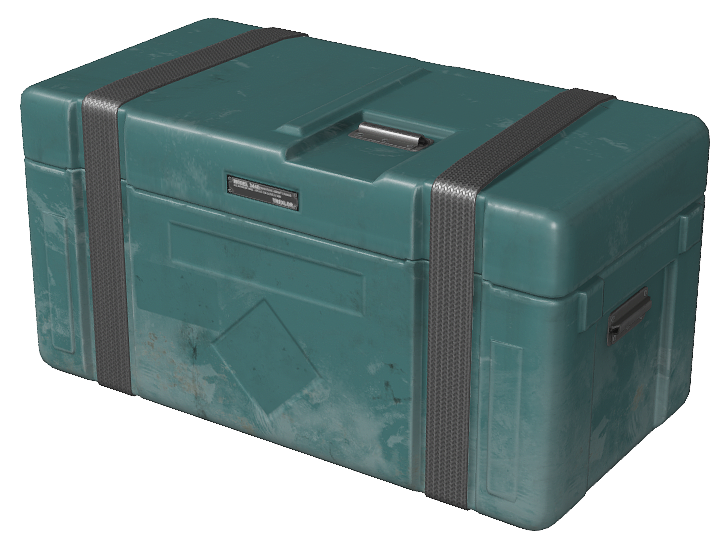
Where is `surface`? surface is located at coordinates (566, 185).